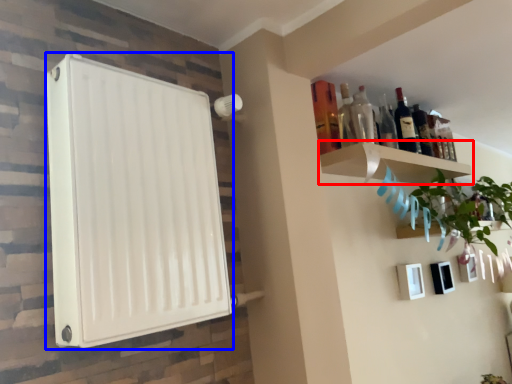
Question: Which object appears farthest to the camera in this image, shelf (highlighted by a red box) or appliance (highlighted by a blue box)?

Choices:
 (A) shelf
 (B) appliance

Answer: (A)